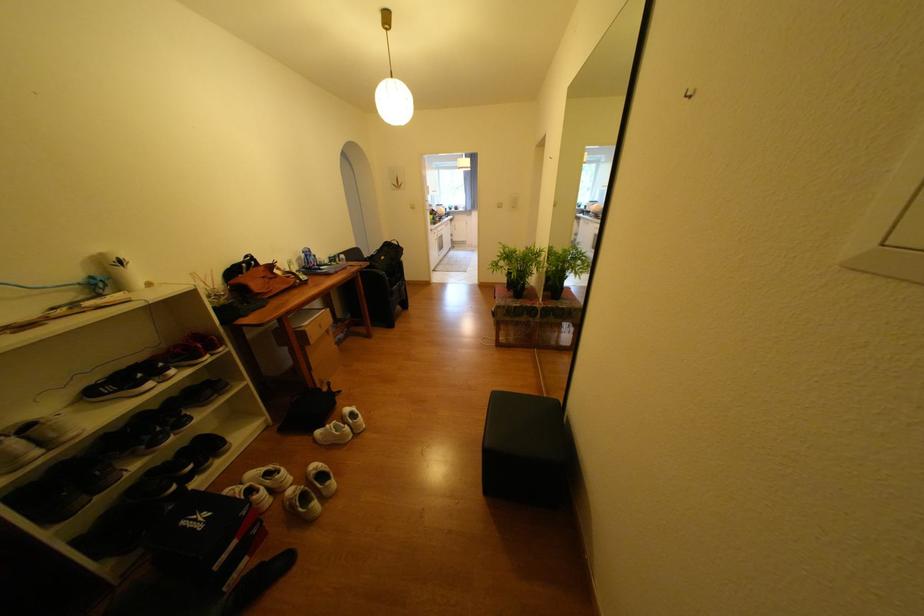
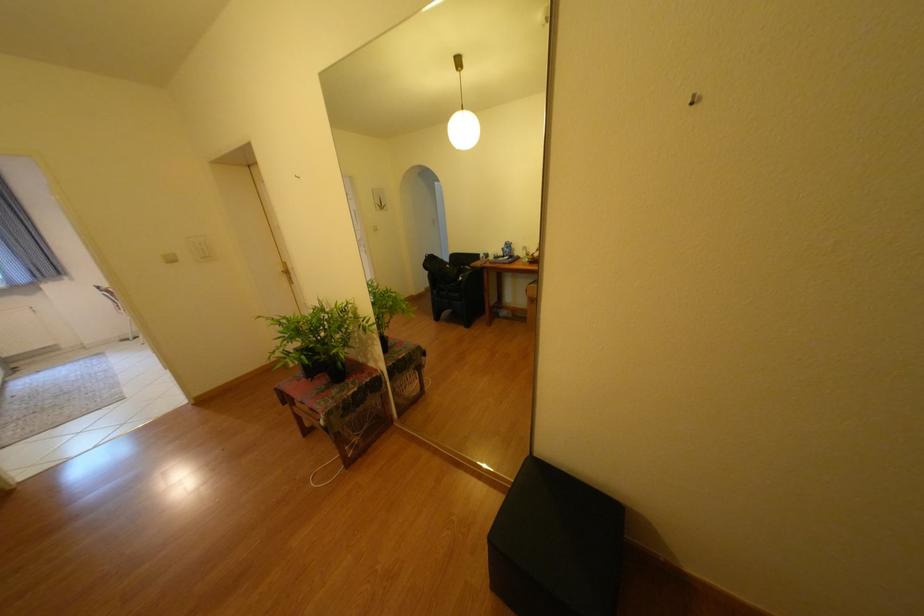
Question: The first image is from the beginning of the video and the second image is from the end. How did the camera likely rotate when shooting the video?

Choices:
 (A) Left
 (B) Right
 (C) Up
 (D) Down

Answer: (B)